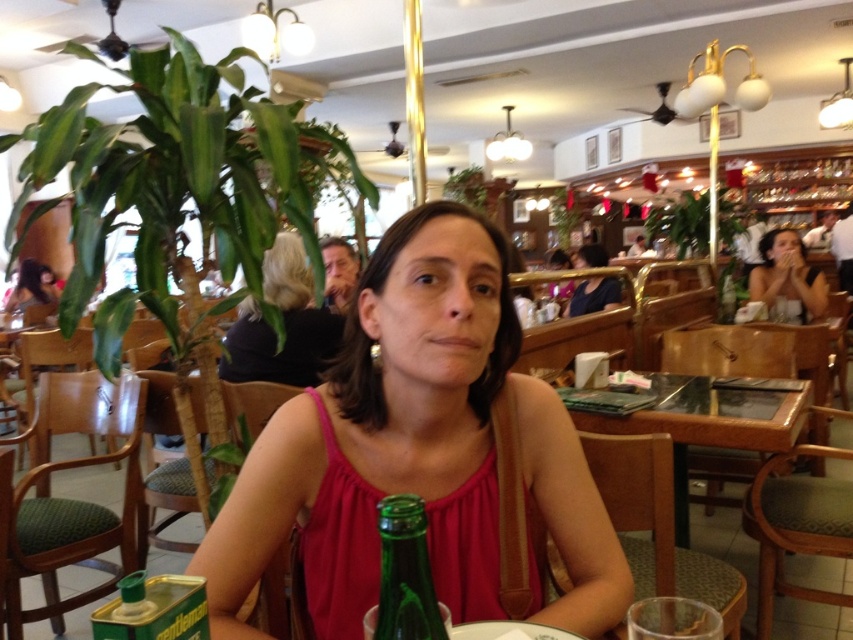
Question: Which of the following is the farthest from the observer?

Choices:
 (A) matte black hair at upper right
 (B) green matte can at center

Answer: (A)

Question: Is pink fabric at center above green glass table at center?

Choices:
 (A) yes
 (B) no

Answer: (A)

Question: Which object is closer to the camera taking this photo?

Choices:
 (A) matte black dress at center
 (B) green glass table at center
 (C) green glass bottle at lower center
 (D) matte black face at upper center

Answer: (C)

Question: Can you confirm if green matte can at center is positioned to the left of matte black dress at center?

Choices:
 (A) yes
 (B) no

Answer: (A)

Question: Is pink fabric at center positioned in front of matte black hair at upper right?

Choices:
 (A) yes
 (B) no

Answer: (A)

Question: Which object is positioned farthest from the matte black face at upper center?

Choices:
 (A) green glass table at center
 (B) matte black hair at upper left
 (C) green glass bottle at lower center
 (D) matte black dress at center

Answer: (B)